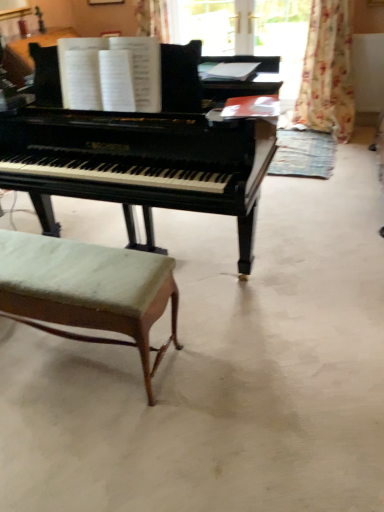
Identify the location of free area below green fabric stool at lower left (from a real-world perspective). This screenshot has height=512, width=384. (65, 357).